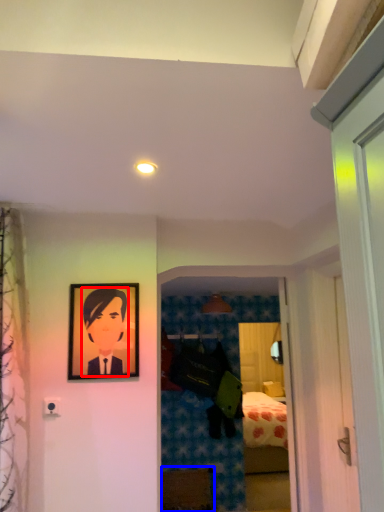
Question: Among these objects, which one is farthest to the camera, person (highlighted by a red box) or furniture (highlighted by a blue box)?

Choices:
 (A) person
 (B) furniture

Answer: (B)